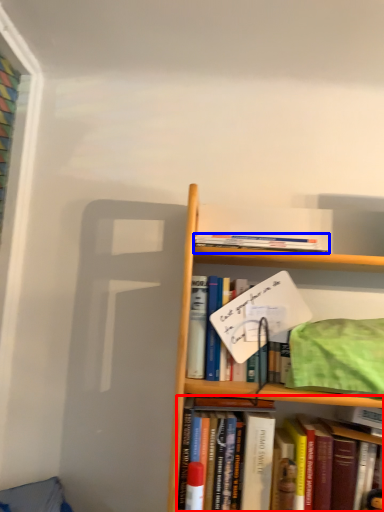
Question: Which object appears farthest to the camera in this image, book (highlighted by a red box) or book (highlighted by a blue box)?

Choices:
 (A) book
 (B) book

Answer: (B)